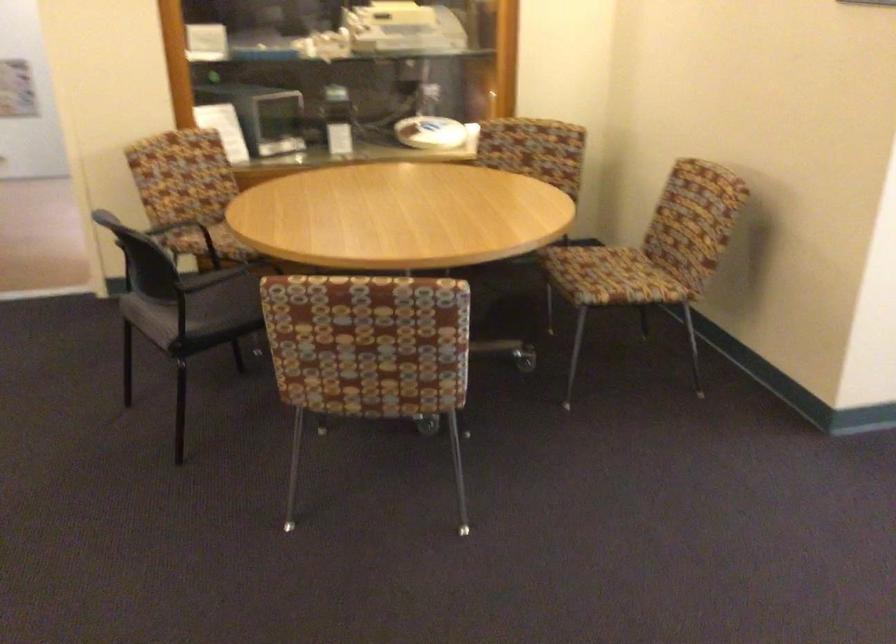
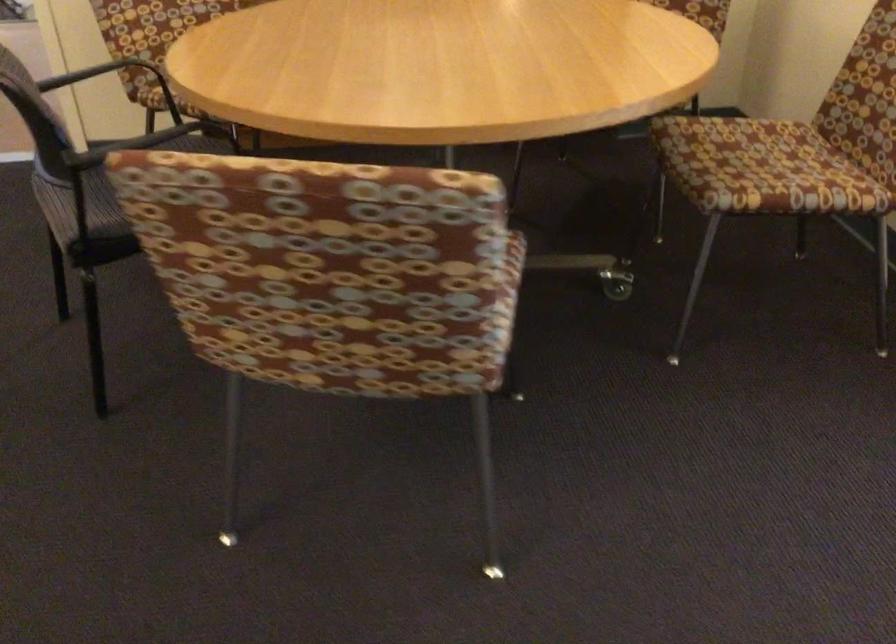
Question: I am providing you with two images of the same scene from different viewpoints. Please identify which objects are invisible in image2.

Choices:
 (A) black chair armrest
 (B) patterned chair sitting surface
 (C) white table fan
 (D) black chair sitting surface

Answer: (D)